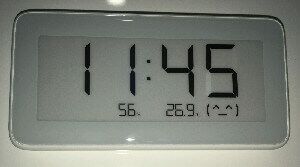
I want to click on digital panel, so click(x=55, y=69).